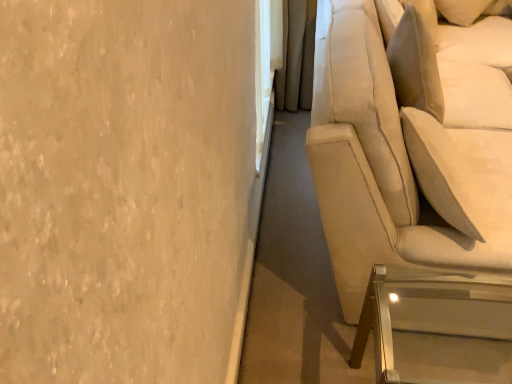
Question: Considering the relative sizes of clear acrylic table at lower right and beige fabric couch at right in the image provided, is clear acrylic table at lower right wider than beige fabric couch at right?

Choices:
 (A) yes
 (B) no

Answer: (B)

Question: Is clear acrylic table at lower right positioned with its back to beige fabric couch at right?

Choices:
 (A) no
 (B) yes

Answer: (A)

Question: Is clear acrylic table at lower right next to beige fabric couch at right?

Choices:
 (A) yes
 (B) no

Answer: (B)

Question: From a real-world perspective, is clear acrylic table at lower right below beige fabric couch at right?

Choices:
 (A) yes
 (B) no

Answer: (A)

Question: Does clear acrylic table at lower right turn towards beige fabric couch at right?

Choices:
 (A) yes
 (B) no

Answer: (B)

Question: Is clear acrylic table at lower right bigger than beige fabric couch at right?

Choices:
 (A) no
 (B) yes

Answer: (A)

Question: From a real-world perspective, is beige fabric couch at right physically above clear acrylic table at lower right?

Choices:
 (A) yes
 (B) no

Answer: (A)

Question: Can you confirm if beige fabric couch at right is bigger than clear acrylic table at lower right?

Choices:
 (A) yes
 (B) no

Answer: (A)

Question: Would you say clear acrylic table at lower right is part of beige fabric couch at right's contents?

Choices:
 (A) yes
 (B) no

Answer: (B)

Question: Considering the relative sizes of beige fabric couch at right and clear acrylic table at lower right in the image provided, is beige fabric couch at right smaller than clear acrylic table at lower right?

Choices:
 (A) yes
 (B) no

Answer: (B)

Question: Is beige fabric couch at right at the right side of clear acrylic table at lower right?

Choices:
 (A) yes
 (B) no

Answer: (A)

Question: Is beige fabric couch at right behind clear acrylic table at lower right?

Choices:
 (A) no
 (B) yes

Answer: (A)

Question: Is point (463, 284) closer or farther from the camera than point (330, 54)?

Choices:
 (A) farther
 (B) closer

Answer: (B)